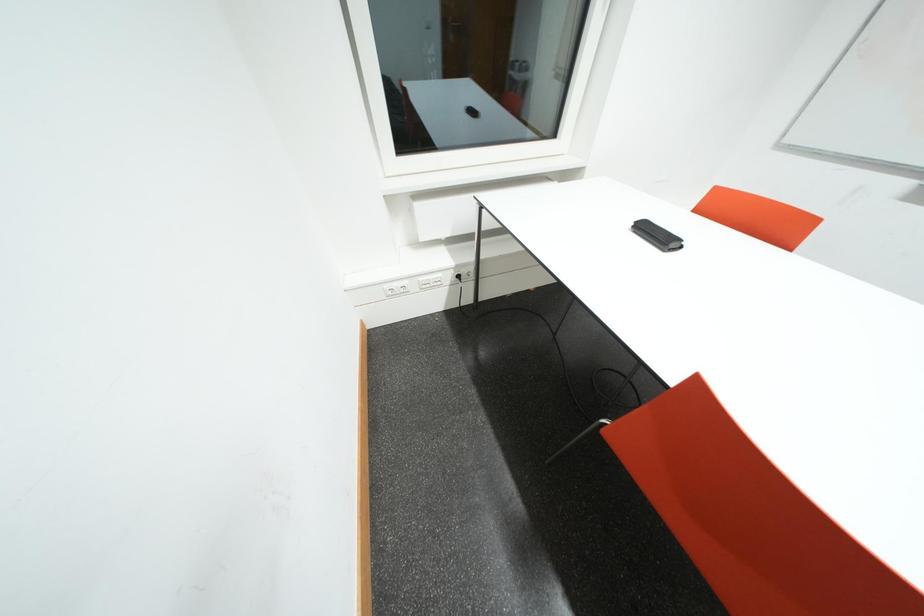
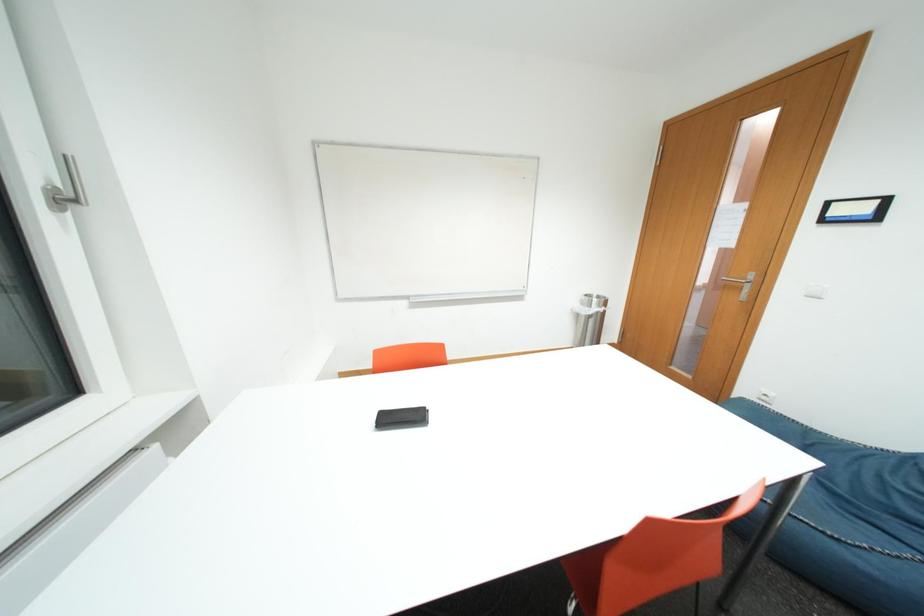
Question: The camera is either moving clockwise (left) or counter-clockwise (right) around the object. The first image is from the beginning of the video and the second image is from the end. Is the camera moving left or right when shooting the video?

Choices:
 (A) Left
 (B) Right

Answer: (A)